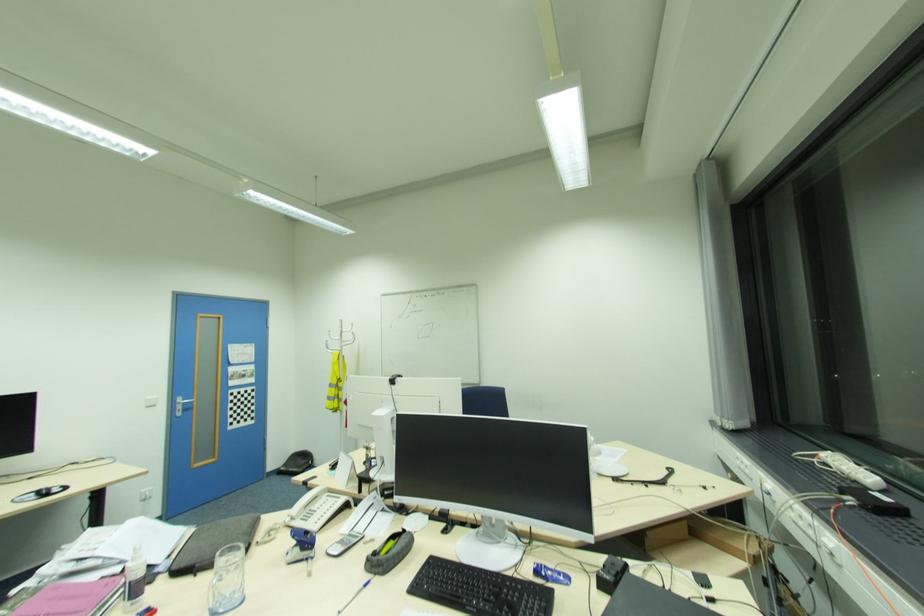
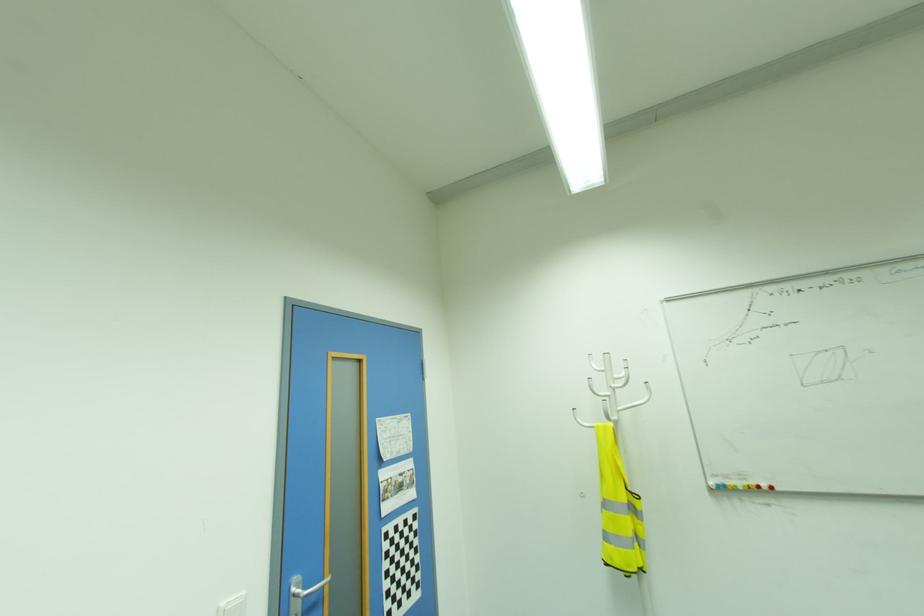
Locate, in the second image, the point that corresponds to [180,400] in the first image.

(296, 590)